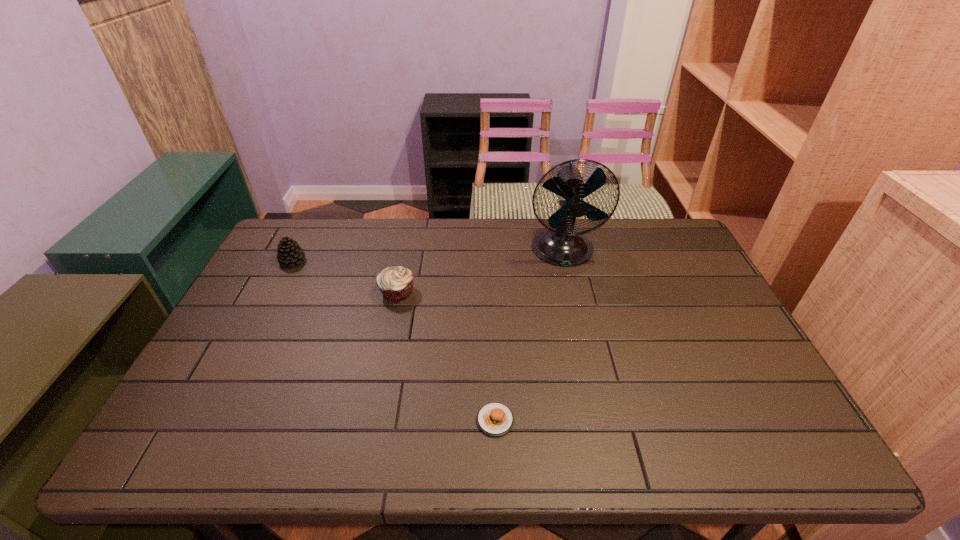
At what (x,y) coordinates should I click in order to perform the action: click on vacant space at the far right corner of the desktop. Please return your answer as a coordinate pair (x, y). Looking at the image, I should click on (686, 241).

Where is `blank space at the near right corner of the desktop`? blank space at the near right corner of the desktop is located at coordinates (802, 442).

This screenshot has height=540, width=960. I want to click on free space that is in between the tallest object and the pinecone, so click(x=428, y=256).

You are a GUI agent. You are given a task and a screenshot of the screen. Output one action in this format:
    pyautogui.click(x=<x>, y=<y>)
    Task: Click on the free point between the leftmost object and the muffin
    The height and width of the screenshot is (540, 960).
    Given the screenshot: What is the action you would take?
    pyautogui.click(x=345, y=276)

At what (x,y) coordinates should I click in order to perform the action: click on free spot between the leftmost object and the tallest object. Please return your answer as a coordinate pair (x, y). Image resolution: width=960 pixels, height=540 pixels. Looking at the image, I should click on pos(428,256).

Locate an element on the screen. This screenshot has width=960, height=540. vacant area that lies between the tallest object and the leftmost object is located at coordinates (428, 256).

At what (x,y) coordinates should I click in order to perform the action: click on vacant space that's between the third object from right to left and the food. Please return your answer as a coordinate pair (x, y). The width and height of the screenshot is (960, 540). Looking at the image, I should click on (446, 356).

Find the location of a particular element. vacant area that lies between the leftmost object and the muffin is located at coordinates (345, 276).

The height and width of the screenshot is (540, 960). I want to click on blank region between the second object from right to left and the rightmost object, so click(529, 335).

Image resolution: width=960 pixels, height=540 pixels. What are the coordinates of `blank region between the rightmost object and the shortest object` in the screenshot? It's located at (529, 335).